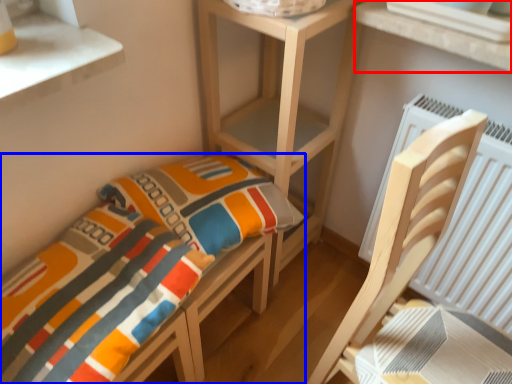
Question: Among these objects, which one is nearest to the camera, window (highlighted by a red box) or furniture (highlighted by a blue box)?

Choices:
 (A) window
 (B) furniture

Answer: (B)